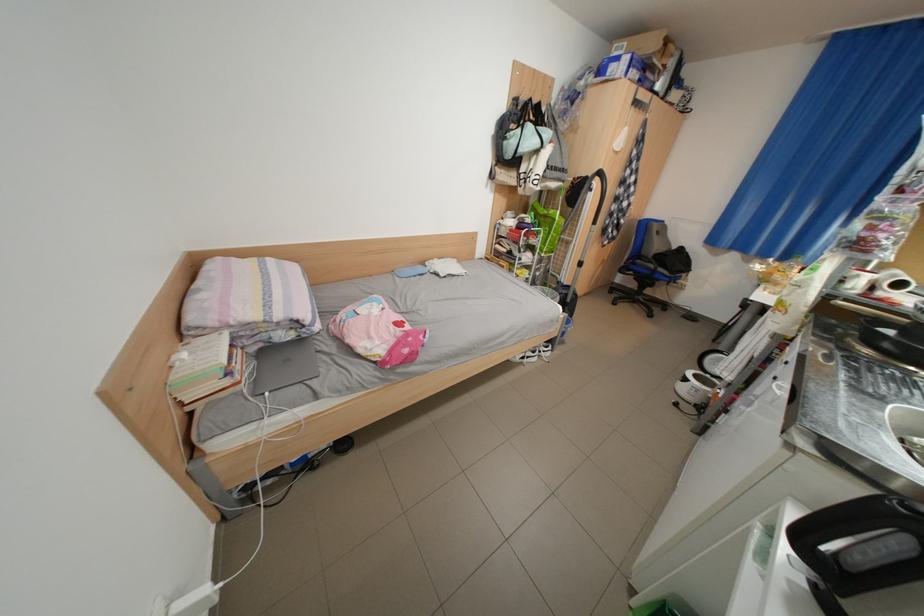
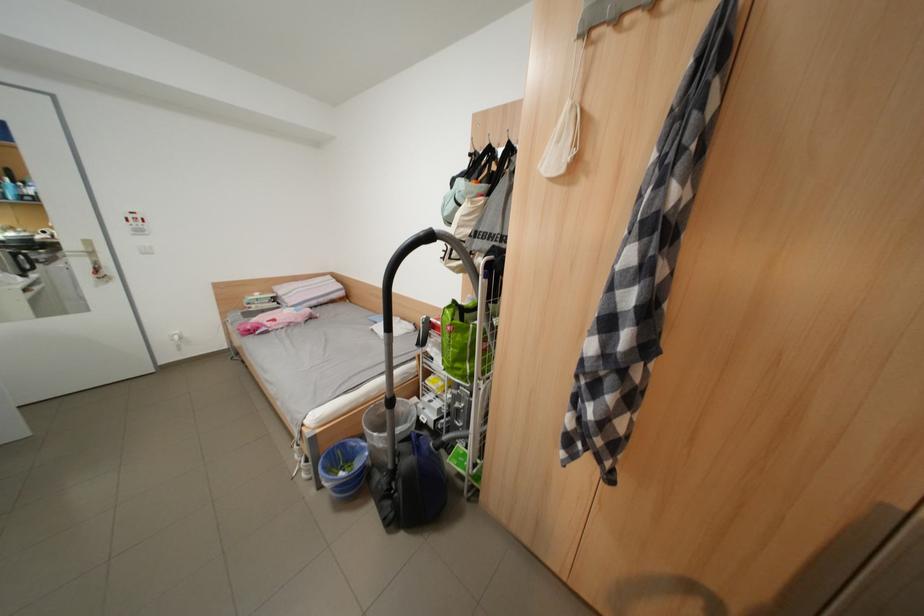
In the second image, find the point that corresponds to (x=456, y=277) in the first image.

(383, 331)